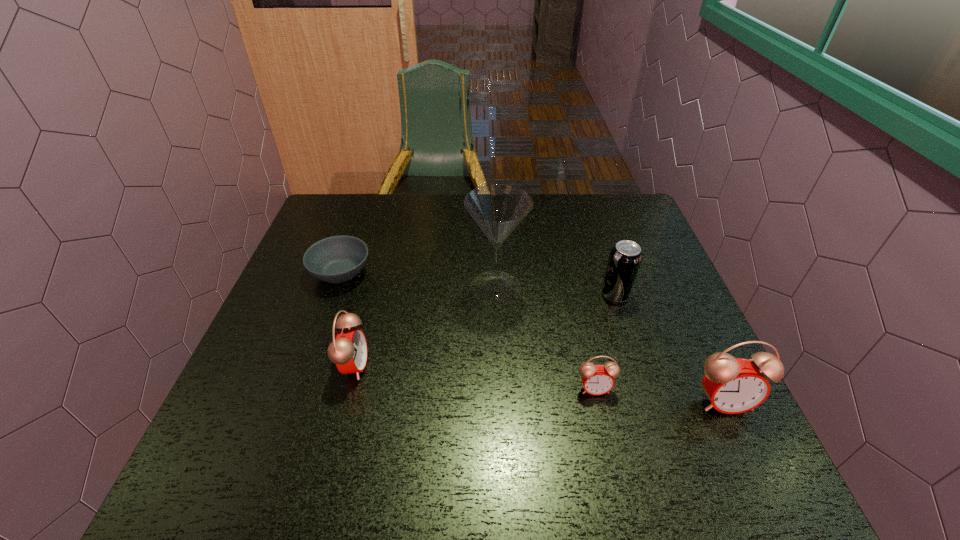
You are a GUI agent. You are given a task and a screenshot of the screen. Output one action in this format:
    pyautogui.click(x=<x>, y=<y>)
    Task: Click on the vacant area situated 0.140m on the front of the tallest object
    The image size is (960, 540).
    Given the screenshot: What is the action you would take?
    pyautogui.click(x=498, y=353)

Where is `blank area located 0.230m on the left of the second object from right to left`? blank area located 0.230m on the left of the second object from right to left is located at coordinates (512, 295).

This screenshot has width=960, height=540. What are the coordinates of `blank space located on the right of the shortest object` in the screenshot? It's located at (400, 272).

The width and height of the screenshot is (960, 540). What are the coordinates of `object at the near edge` in the screenshot? It's located at (733, 385).

You are a GUI agent. You are given a task and a screenshot of the screen. Output one action in this format:
    pyautogui.click(x=<x>, y=<y>)
    Task: Click on the object located in the left edge section of the desktop
    
    Given the screenshot: What is the action you would take?
    337,259

Where is `alarm clock at the right edge`? The width and height of the screenshot is (960, 540). alarm clock at the right edge is located at coordinates (733, 385).

You are a GUI agent. You are given a task and a screenshot of the screen. Output one action in this format:
    pyautogui.click(x=<x>, y=<y>)
    Task: Click on the soda can located in the right edge section of the desktop
    Image resolution: width=960 pixels, height=540 pixels.
    Given the screenshot: What is the action you would take?
    pyautogui.click(x=625, y=258)

Find the location of a particular element. This screenshot has height=540, width=960. object that is at the near right corner is located at coordinates (x=733, y=385).

The height and width of the screenshot is (540, 960). Find the location of `free space at the far edge of the desktop`. free space at the far edge of the desktop is located at coordinates (552, 222).

Image resolution: width=960 pixels, height=540 pixels. I want to click on free space at the near edge of the desktop, so click(x=419, y=416).